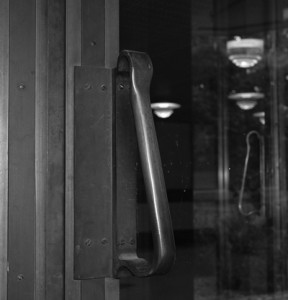
Find the location of `handle`. handle is located at coordinates (159, 181).